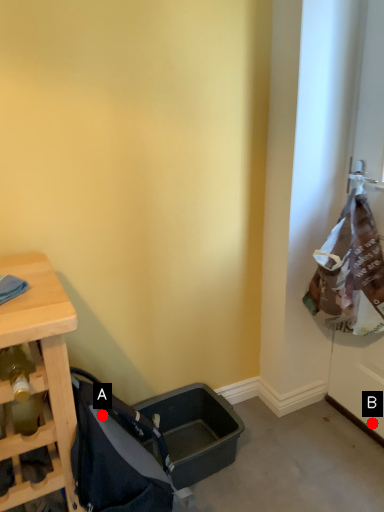
Question: Two points are circled on the image, labeled by A and B beside each circle. Which point is farther from the camera taking this photo?

Choices:
 (A) A is further
 (B) B is further

Answer: (B)